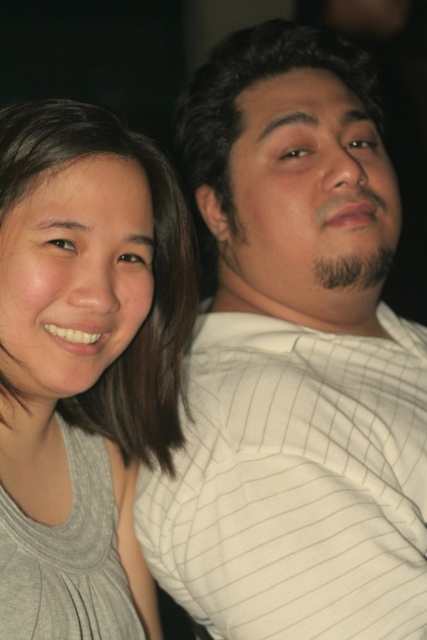
You are a clothing designer analyzing the image. You need to determine which item of clothing has a bigger size between the white striped shirt at upper right and the gray matte tank top at left. Based on the scene, what can you conclude?

The white striped shirt at upper right has a larger size compared to the gray matte tank top at left.

You are a photographer reviewing this image. You need to adjust the lighting to highlight the white striped shirt at upper right and the gray matte tank top at left. Which object should you focus on first if you want to ensure both are properly lit?

The white striped shirt at upper right should be focused on first since it is located above the gray matte tank top at left, allowing you to adjust the lighting from top to bottom for both objects.